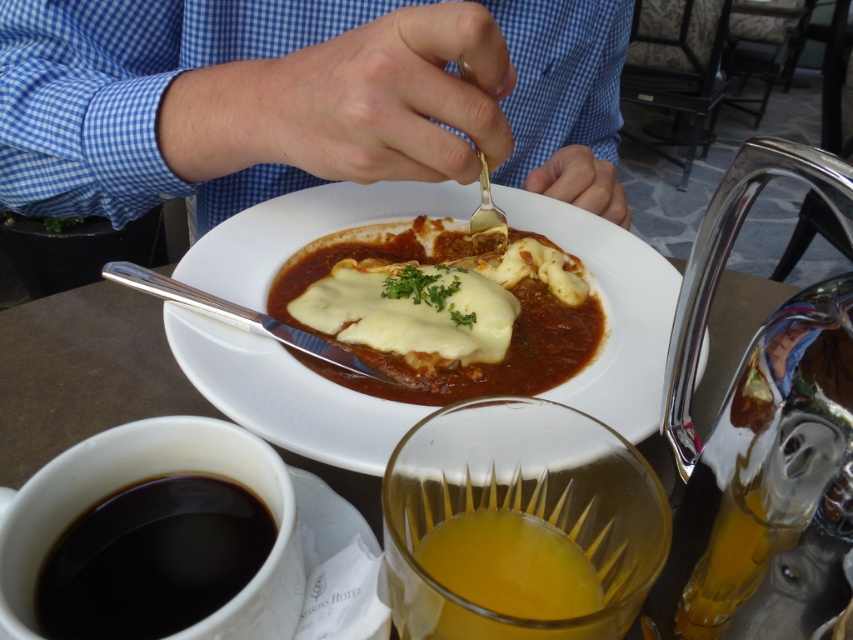
Does point (437, 230) come farther from viewer compared to point (152, 609)?

That is True.

Is white creamy lasagna at center wider than black matte cup at lower left?

Indeed, white creamy lasagna at center has a greater width compared to black matte cup at lower left.

Is point (432, 236) farther from camera compared to point (218, 596)?

Yes, point (432, 236) is behind point (218, 596).

Find the location of a particular element. white creamy lasagna at center is located at coordinates (x=440, y=310).

Is white glossy plate at center bigger than translucent glass orange juice at lower center?

Indeed, white glossy plate at center has a larger size compared to translucent glass orange juice at lower center.

Is white glossy plate at center to the left of translucent glass orange juice at lower center from the viewer's perspective?

Indeed, white glossy plate at center is positioned on the left side of translucent glass orange juice at lower center.

Between point (560, 397) and point (442, 593), which one is positioned in front?

Point (442, 593) is more forward.

Where is `white glossy plate at center`? white glossy plate at center is located at coordinates (285, 396).

Who is more forward, (582, 148) or (531, 520)?

Point (531, 520) is in front.

Does blue checkered shirt at upper center have a larger size compared to translucent yellow liquid at lower center?

Correct, blue checkered shirt at upper center is larger in size than translucent yellow liquid at lower center.

Where is `blue checkered shirt at upper center`? blue checkered shirt at upper center is located at coordinates (303, 99).

You are a GUI agent. You are given a task and a screenshot of the screen. Output one action in this format:
    pyautogui.click(x=<x>, y=<y>)
    Task: Click on the blue checkered shirt at upper center
    The image size is (853, 640).
    Given the screenshot: What is the action you would take?
    pyautogui.click(x=303, y=99)